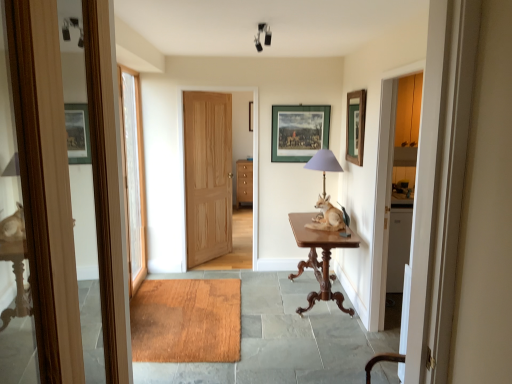
At what (x,y) coordinates should I click in order to perform the action: click on green matte picture frame at center, acting as the first picture frame starting from the left. Please return your answer as a coordinate pair (x, y). The width and height of the screenshot is (512, 384). Looking at the image, I should click on (298, 132).

Identify the location of mahogany wood table at center. The height and width of the screenshot is (384, 512). (317, 260).

Describe the element at coordinates (317, 260) in the screenshot. I see `mahogany wood table at center` at that location.

Describe the element at coordinates (355, 126) in the screenshot. The width and height of the screenshot is (512, 384). I see `green matte picture frame at upper right, positioned as the second picture frame in back-to-front order` at that location.

In order to click on green matte picture frame at upper right, acting as the 1th picture frame starting from the right in this screenshot , I will do `click(355, 126)`.

Image resolution: width=512 pixels, height=384 pixels. I want to click on matte purple glass table lamp at center, so click(324, 164).

The image size is (512, 384). Identify the location of brown wooden table at center. (327, 216).

Image resolution: width=512 pixels, height=384 pixels. I want to click on wooden mat at center, so click(283, 337).

Based on the photo, how much space does natural wood door at center, which is counted as the first door, starting from the right, occupy horizontally?

natural wood door at center, which is counted as the first door, starting from the right, is 4.97 inches wide.

Locate an element on the screen. This screenshot has width=512, height=384. green matte picture frame at center, the 1th picture frame positioned from the back is located at coordinates (298, 132).

How different are the orientations of natural wood door at center, marked as the 2th door in a left-to-right arrangement, and brown wooden table at center in degrees?

The facing directions of natural wood door at center, marked as the 2th door in a left-to-right arrangement, and brown wooden table at center are 139 degrees apart.

Is natural wood door at center, the 1th door positioned from the back, directly adjacent to brown wooden table at center?

natural wood door at center, the 1th door positioned from the back, and brown wooden table at center are not in contact.

Does point (204, 200) come in front of point (309, 223)?

No, it is not.

In terms of width, does natural wood door at center, the 2th door viewed from the front, look wider or thinner when compared to brown wooden table at center?

natural wood door at center, the 2th door viewed from the front, is thinner than brown wooden table at center.

Is green matte picture frame at upper right, the 2th picture frame when ordered from left to right, positioned far away from green matte picture frame at center, which is counted as the second picture frame, starting from the right?

Actually, green matte picture frame at upper right, the 2th picture frame when ordered from left to right, and green matte picture frame at center, which is counted as the second picture frame, starting from the right, are a little close together.

Between green matte picture frame at upper right, the 2th picture frame when ordered from left to right, and green matte picture frame at center, acting as the first picture frame starting from the left, which one has less height?

With less height is green matte picture frame at center, acting as the first picture frame starting from the left.

Consider the image. Is green matte picture frame at upper right, positioned as the second picture frame in back-to-front order, not inside green matte picture frame at center, which is the second picture frame in front-to-back order?

Indeed, green matte picture frame at upper right, positioned as the second picture frame in back-to-front order, is completely outside green matte picture frame at center, which is the second picture frame in front-to-back order.

From the image's perspective, is green matte picture frame at upper right, which ranks as the 1th picture frame in front-to-back order, over green matte picture frame at center, the 1th picture frame positioned from the back?

Incorrect, from the image's perspective, green matte picture frame at upper right, which ranks as the 1th picture frame in front-to-back order, is lower than green matte picture frame at center, the 1th picture frame positioned from the back.

Which object is closer to the camera taking this photo, green matte picture frame at upper right, which ranks as the 1th picture frame in front-to-back order, or mahogany wood table at center?

mahogany wood table at center.

Is green matte picture frame at upper right, the 2th picture frame when ordered from left to right, oriented away from mahogany wood table at center?

No, green matte picture frame at upper right, the 2th picture frame when ordered from left to right, is not facing the opposite direction of mahogany wood table at center.

From the picture: Does green matte picture frame at upper right, which ranks as the 1th picture frame in front-to-back order, have a lesser width compared to mahogany wood table at center?

Yes.

Is point (347, 120) closer or farther from the camera than point (313, 238)?

Point (347, 120) is positioned farther from the camera compared to point (313, 238).

Considering the points (321, 169) and (292, 128), which point is in front, point (321, 169) or point (292, 128)?

The point (321, 169) is in front.

The height and width of the screenshot is (384, 512). There is a matte purple glass table lamp at center. Identify the location of the 2nd picture frame above it (from the image's perspective). (298, 132).

Considering the relative sizes of matte purple glass table lamp at center and green matte picture frame at center, which is counted as the second picture frame, starting from the right, in the image provided, is matte purple glass table lamp at center smaller than green matte picture frame at center, which is counted as the second picture frame, starting from the right,?

Actually, matte purple glass table lamp at center might be larger than green matte picture frame at center, which is counted as the second picture frame, starting from the right.

Based on the photo, would you consider mahogany wood table at center to be distant from green matte picture frame at center, which is counted as the second picture frame, starting from the right?

Yes, mahogany wood table at center and green matte picture frame at center, which is counted as the second picture frame, starting from the right, are located far from each other.

In the scene shown: From the image's perspective, is mahogany wood table at center on top of green matte picture frame at center, the 1th picture frame positioned from the back?

No, from the image's perspective, mahogany wood table at center is not on top of green matte picture frame at center, the 1th picture frame positioned from the back.

Is mahogany wood table at center smaller than green matte picture frame at center, which is the second picture frame in front-to-back order?

No, mahogany wood table at center is not smaller than green matte picture frame at center, which is the second picture frame in front-to-back order.

Looking at this image, how many degrees apart are the facing directions of mahogany wood table at center and green matte picture frame at center, acting as the first picture frame starting from the left?

91.2 degrees.

Does wooden mat at center have a greater height compared to natural wood door at center, the 2th door viewed from the front?

No.

Can you confirm if wooden mat at center is smaller than natural wood door at center, which is counted as the first door, starting from the right?

No.

Is wooden mat at center aimed at natural wood door at center, the 2th door viewed from the front?

No, wooden mat at center does not turn towards natural wood door at center, the 2th door viewed from the front.

Is wooden mat at center far away from natural wood door at center, marked as the 2th door in a left-to-right arrangement?

wooden mat at center is far away from natural wood door at center, marked as the 2th door in a left-to-right arrangement.

Is point (289, 127) in front of point (359, 94)?

No, it is not.

Who is smaller, green matte picture frame at center, the 1th picture frame positioned from the back, or green matte picture frame at upper right, which ranks as the 1th picture frame in front-to-back order?

green matte picture frame at center, the 1th picture frame positioned from the back.

Which is more to the right, green matte picture frame at center, the 1th picture frame positioned from the back, or green matte picture frame at upper right, which ranks as the 1th picture frame in front-to-back order?

green matte picture frame at upper right, which ranks as the 1th picture frame in front-to-back order, is more to the right.

This screenshot has width=512, height=384. I want to click on door that is the 2nd one above the brown wooden table at center (from a real-world perspective), so click(x=207, y=175).

The image size is (512, 384). In order to click on picture frame above the green matte picture frame at upper right, acting as the 1th picture frame starting from the right (from the image's perspective) in this screenshot , I will do `click(298, 132)`.

Estimate the real-world distances between objects in this image. Which object is further from wooden mat at center, brown wooden table at center or natural wood door at center, marked as the 2th door in a left-to-right arrangement?

Based on the image, natural wood door at center, marked as the 2th door in a left-to-right arrangement, appears to be further to wooden mat at center.

When comparing their distances from wooden mat at center, does green matte picture frame at upper right, acting as the 1th picture frame starting from the right, or brown wooden table at center seem closer?

brown wooden table at center is closer to wooden mat at center.

Which object lies further to the anchor point green matte picture frame at center, acting as the first picture frame starting from the left, white glass door at left, the 2th door positioned from the right, or matte purple glass table lamp at center?

white glass door at left, the 2th door positioned from the right, is positioned further to the anchor green matte picture frame at center, acting as the first picture frame starting from the left.

Estimate the real-world distances between objects in this image. Which object is further from wooden mat at center, brown wooden table at center or white glass door at left, acting as the first door starting from the left?

The object further to wooden mat at center is white glass door at left, acting as the first door starting from the left.

Consider the image. When comparing their distances from wooden mat at center, does brown wooden table at center or matte purple glass table lamp at center seem further?

The object further to wooden mat at center is matte purple glass table lamp at center.

When comparing their distances from green matte picture frame at center, which is the second picture frame in front-to-back order, does natural wood door at center, the 1th door positioned from the back, or brown wooden table at center seem further?

The object further to green matte picture frame at center, which is the second picture frame in front-to-back order, is natural wood door at center, the 1th door positioned from the back.

From the image, which object appears to be nearer to brown wooden table at center, wooden mat at center or natural wood door at center, which is counted as the first door, starting from the right?

wooden mat at center.

Which object lies further to the anchor point green matte picture frame at upper right, which ranks as the 1th picture frame in front-to-back order, mahogany wood table at center or wooden mat at center?

Among the two, wooden mat at center is located further to green matte picture frame at upper right, which ranks as the 1th picture frame in front-to-back order.

Locate an element on the screen. picture frame between white glass door at left, acting as the first door starting from the left, and green matte picture frame at upper right, positioned as the second picture frame in back-to-front order is located at coordinates (298, 132).

Identify the location of open between matte purple glass table lamp at center and wooden mat at center vertically. The width and height of the screenshot is (512, 384). (327, 216).

Image resolution: width=512 pixels, height=384 pixels. What are the coordinates of `table between wooden mat at center and natural wood door at center, which is counted as the first door, starting from the right, along the z-axis` in the screenshot? It's located at (317, 260).

At what (x,y) coordinates should I click in order to perform the action: click on table between natural wood door at center, marked as the 2th door in a left-to-right arrangement, and matte purple glass table lamp at center. Please return your answer as a coordinate pair (x, y). Looking at the image, I should click on (317, 260).